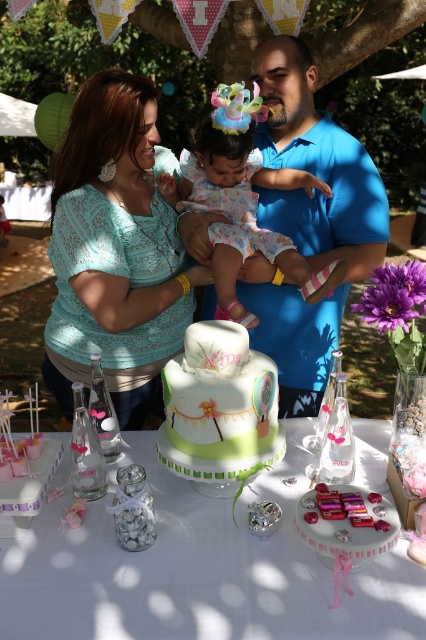
Does point (195, 611) come behind point (333, 310)?

No, (195, 611) is closer to viewer.

Locate an element on the screen. pastel green cake at center is located at coordinates (198, 570).

The width and height of the screenshot is (426, 640). I want to click on pastel green cake at center, so click(198, 570).

Who is more forward, (129,422) or (222,99)?

Point (222,99)

Which is more to the left, matte teal lace blouse at center or pastel floral dress at center?

Positioned to the left is matte teal lace blouse at center.

Where is `matte teal lace blouse at center`? matte teal lace blouse at center is located at coordinates (115, 252).

Image resolution: width=426 pixels, height=640 pixels. I want to click on matte teal lace blouse at center, so click(115, 252).

Between point (321, 177) and point (227, 125), which one is positioned in front?

Point (227, 125)

Who is more distant from viewer, (342,241) or (189,173)?

Positioned behind is point (189,173).

You are a GUI agent. You are given a task and a screenshot of the screen. Output one action in this format:
    pyautogui.click(x=<x>, y=<y>)
    Task: Click on the blue cotton shirt at center
    
    Given the screenshot: What is the action you would take?
    pyautogui.click(x=307, y=224)